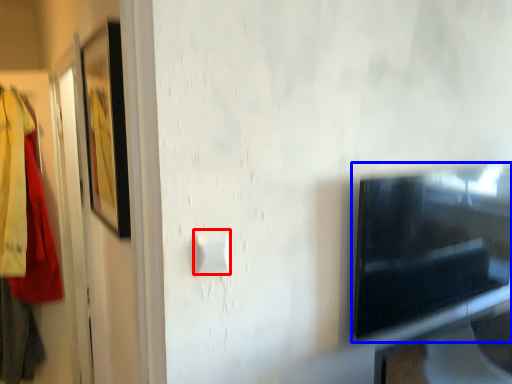
Question: Among these objects, which one is farthest to the camera, light switch (highlighted by a red box) or appliance (highlighted by a blue box)?

Choices:
 (A) light switch
 (B) appliance

Answer: (B)